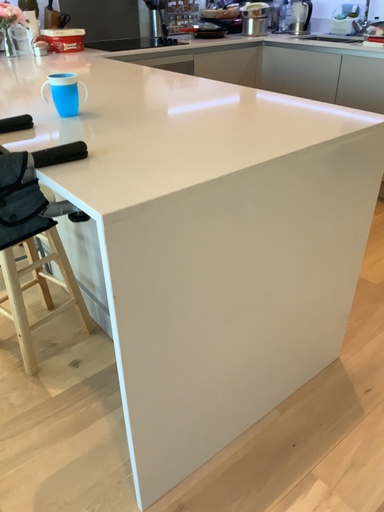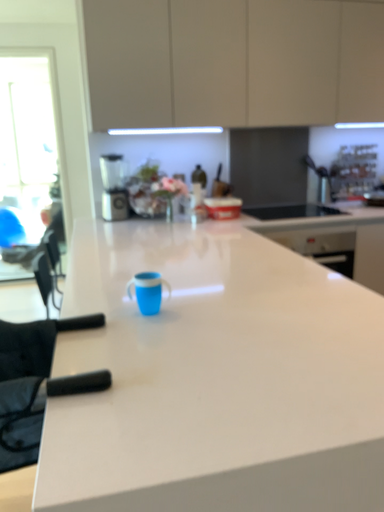
Question: Which way did the camera rotate in the video?

Choices:
 (A) rotated left
 (B) rotated right

Answer: (A)